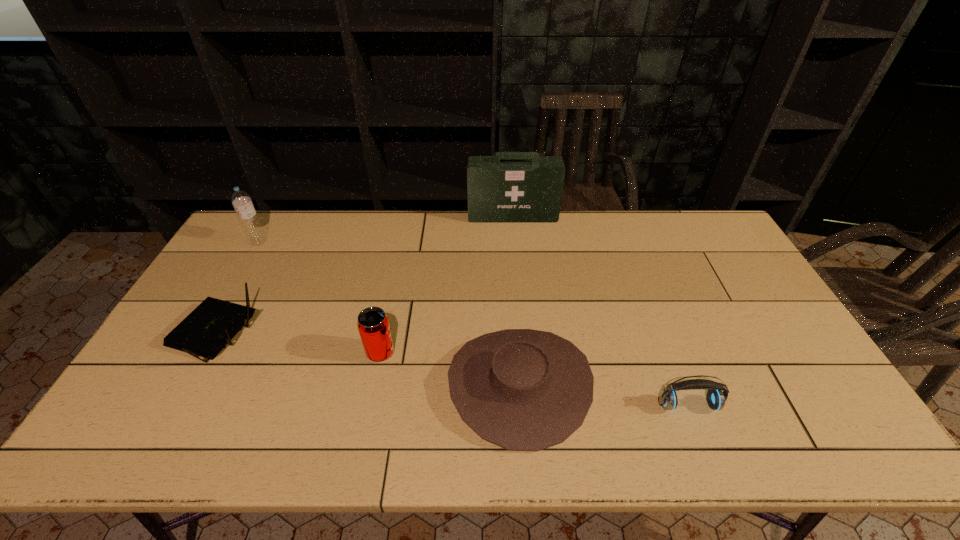
At what (x,y) coordinates should I click in order to perform the action: click on free point at the far edge. Please return your answer as a coordinate pair (x, y). Looking at the image, I should click on (525, 246).

The image size is (960, 540). I want to click on vacant point at the right edge, so pyautogui.click(x=736, y=270).

Where is `blank space at the near right corner of the desktop`? The width and height of the screenshot is (960, 540). blank space at the near right corner of the desktop is located at coordinates (836, 434).

At what (x,y) coordinates should I click in order to perform the action: click on vacant space that's between the router and the farthest object. Please return your answer as a coordinate pair (x, y). This screenshot has width=960, height=540. Looking at the image, I should click on (363, 276).

At what (x,y) coordinates should I click in order to perform the action: click on free space between the router and the fourth shortest object. Please return your answer as a coordinate pair (x, y). The width and height of the screenshot is (960, 540). Looking at the image, I should click on (297, 345).

At what (x,y) coordinates should I click in order to perform the action: click on vacant region between the router and the tallest object. Please return your answer as a coordinate pair (x, y). The width and height of the screenshot is (960, 540). Looking at the image, I should click on (363, 276).

Where is `free space between the water bottle and the rightmost object`? free space between the water bottle and the rightmost object is located at coordinates (473, 323).

This screenshot has height=540, width=960. What are the coordinates of `free space between the farthest object and the headset` in the screenshot? It's located at click(x=601, y=311).

Where is `free space between the headset and the cowboy hat`? The height and width of the screenshot is (540, 960). free space between the headset and the cowboy hat is located at coordinates (604, 395).

The width and height of the screenshot is (960, 540). Identify the location of vacant area that lies between the tallest object and the rightmost object. (601, 311).